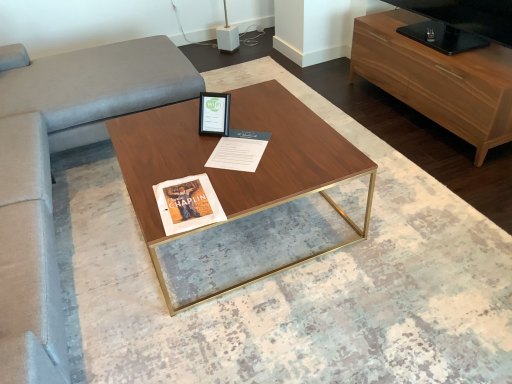
Where is `unoccupied area behind white paper at center`? The image size is (512, 384). unoccupied area behind white paper at center is located at coordinates 248,115.